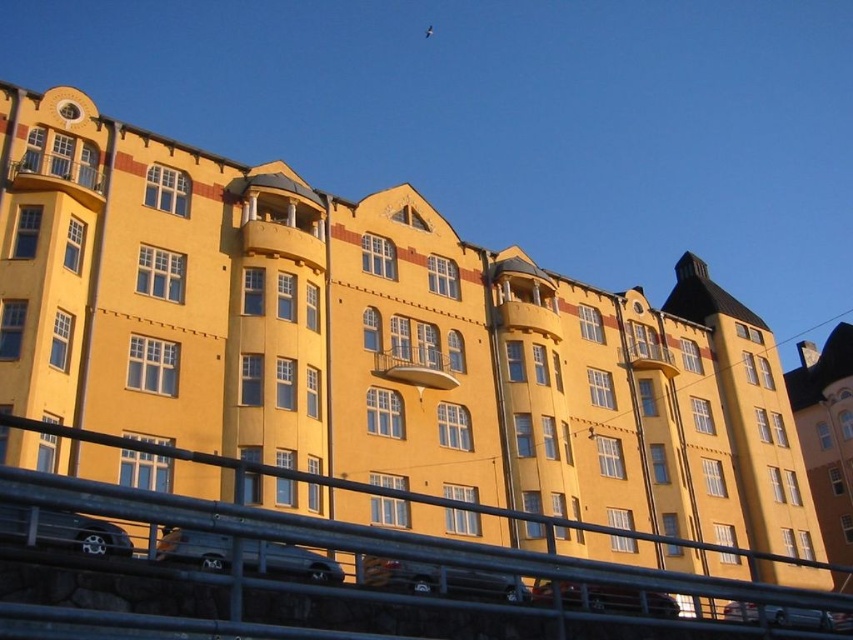
Does metallic silver car at center have a lesser height compared to metallic silver car at lower right?

Indeed, metallic silver car at center has a lesser height compared to metallic silver car at lower right.

Based on the photo, is metallic silver car at center closer to camera compared to metallic silver car at lower right?

Yes.

Who is more forward, (590, 596) or (756, 608)?

Point (756, 608)

The image size is (853, 640). What are the coordinates of `metallic silver car at center` in the screenshot? It's located at pos(612,596).

Looking at this image, can you confirm if metallic gray rail at lower center is bigger than metallic silver car at lower right?

Yes, metallic gray rail at lower center is bigger than metallic silver car at lower right.

Does metallic gray rail at lower center have a smaller size compared to metallic silver car at lower right?

No.

Is point (659, 579) closer to camera compared to point (843, 627)?

That is True.

You are a GUI agent. You are given a task and a screenshot of the screen. Output one action in this format:
    pyautogui.click(x=<x>, y=<y>)
    Task: Click on the metallic gray rail at lower center
    The width and height of the screenshot is (853, 640).
    Given the screenshot: What is the action you would take?
    pyautogui.click(x=370, y=589)

From the picture: Can you confirm if metallic gray rail at lower center is positioned to the left of silver metallic van at lower center?

In fact, metallic gray rail at lower center is to the right of silver metallic van at lower center.

Image resolution: width=853 pixels, height=640 pixels. Describe the element at coordinates (370, 589) in the screenshot. I see `metallic gray rail at lower center` at that location.

Where is `metallic gray rail at lower center`? This screenshot has width=853, height=640. metallic gray rail at lower center is located at coordinates (370, 589).